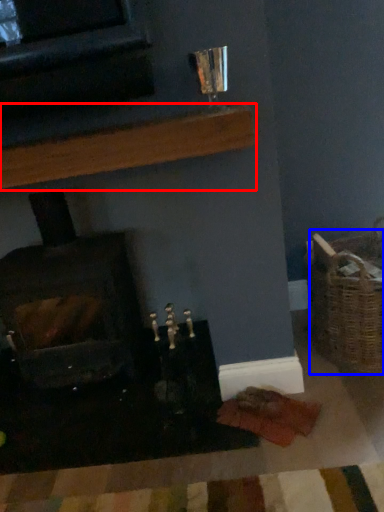
Question: Which object appears farthest to the camera in this image, shelf (highlighted by a red box) or basket (highlighted by a blue box)?

Choices:
 (A) shelf
 (B) basket

Answer: (B)